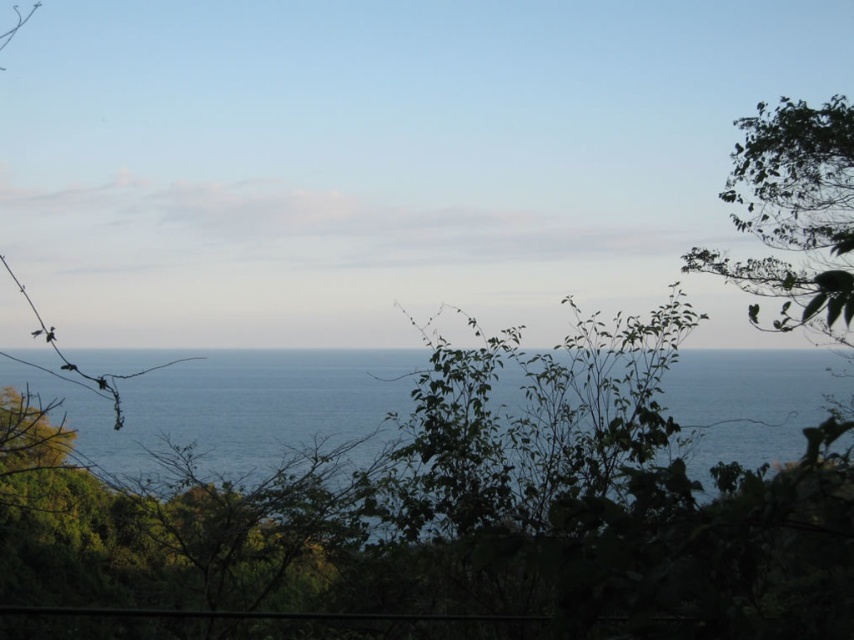
Which of these two, blue water at center or green leafy tree at upper right, stands taller?

With more height is green leafy tree at upper right.

Can you confirm if blue water at center is wider than green leafy tree at upper right?

Indeed, blue water at center has a greater width compared to green leafy tree at upper right.

Between point (320, 374) and point (794, 209), which one is positioned in front?

Positioned in front is point (794, 209).

This screenshot has width=854, height=640. What are the coordinates of `blue water at center` in the screenshot? It's located at (237, 404).